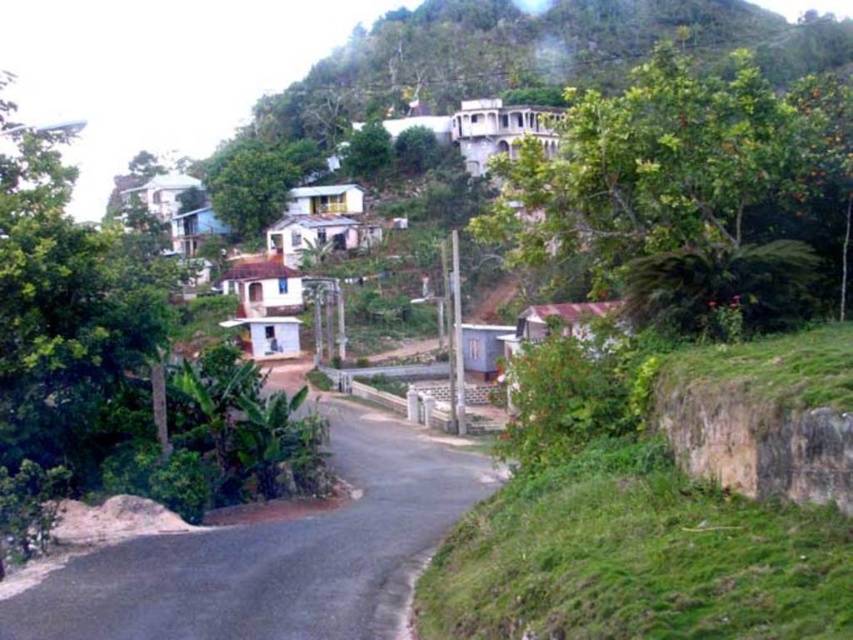
You are standing at the center of the winding road and want to locate the green leafy tree at upper right. According to the coordinates provided, where should you look relative to your position?

The green leafy tree at upper right is located at coordinates point [683,184], which means it is positioned to the upper right relative to your central position on the winding road.

You are driving along the asphalt road at center and want to know if you can see the green leafy tree at left through the windshield. Can you see it from your current position?

The asphalt road at center is behind green leafy tree at left, so you cannot see the green leafy tree at left through the windshield because the road is positioned behind it from your viewpoint.